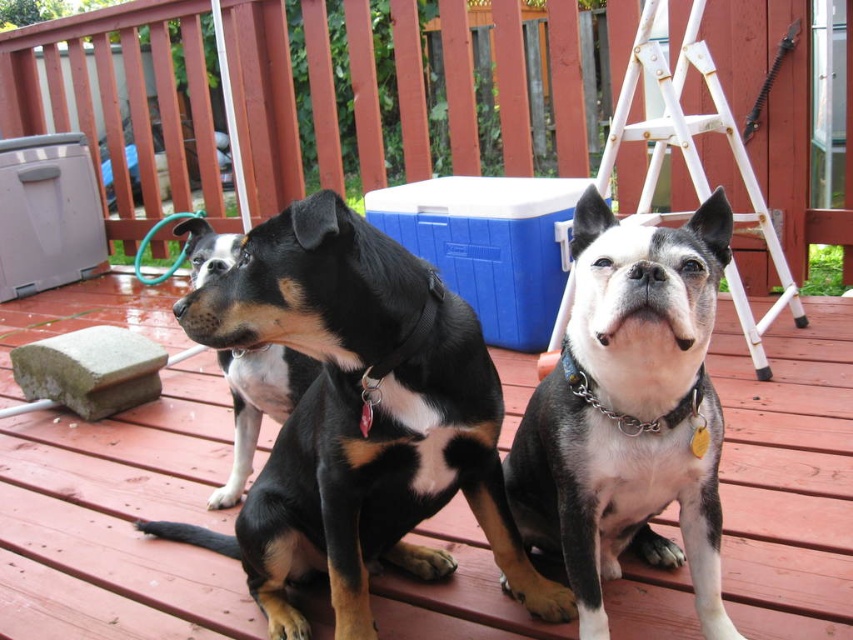
What is the 2D coordinate of the wooden deck at center?

The wooden deck at center is located at the 2D coordinate point of [120,518].